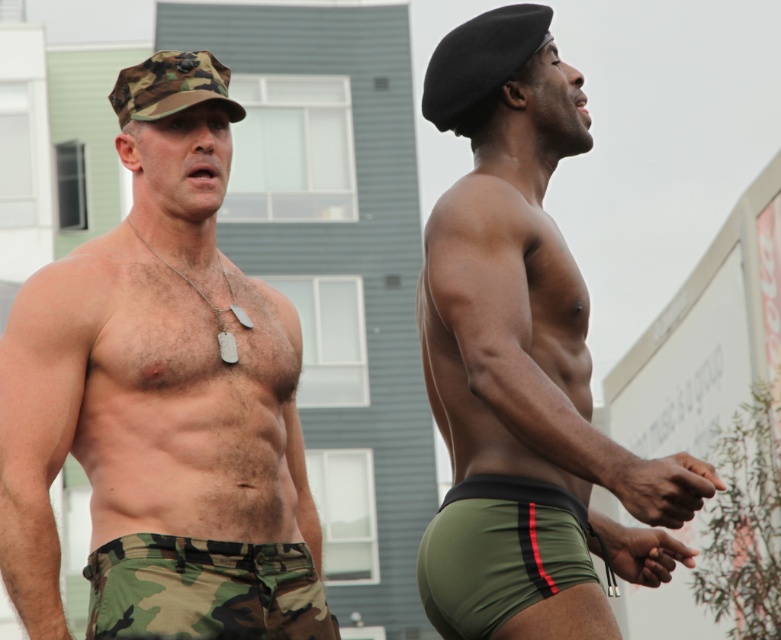
Question: Which point is farther to the camera?

Choices:
 (A) olive green fabric shorts at lower right
 (B) camo fabric shorts at lower left

Answer: (B)

Question: Considering the relative positions of olive green spandex briefs at right and olive green fabric shorts at lower right in the image provided, where is olive green spandex briefs at right located with respect to olive green fabric shorts at lower right?

Choices:
 (A) above
 (B) below

Answer: (A)

Question: Which point is farther to the camera?

Choices:
 (A) (480, 611)
 (B) (152, 384)
 (C) (551, 60)

Answer: (B)

Question: Is the position of camo fabric shorts at left less distant than that of camo fabric shorts at lower left?

Choices:
 (A) yes
 (B) no

Answer: (B)

Question: Which of the following is the farthest from the observer?

Choices:
 (A) camo fabric shorts at left
 (B) camo fabric shorts at lower left
 (C) olive green fabric shorts at lower right

Answer: (A)

Question: Can you confirm if camo fabric shorts at lower left is smaller than olive green fabric shorts at lower right?

Choices:
 (A) yes
 (B) no

Answer: (B)